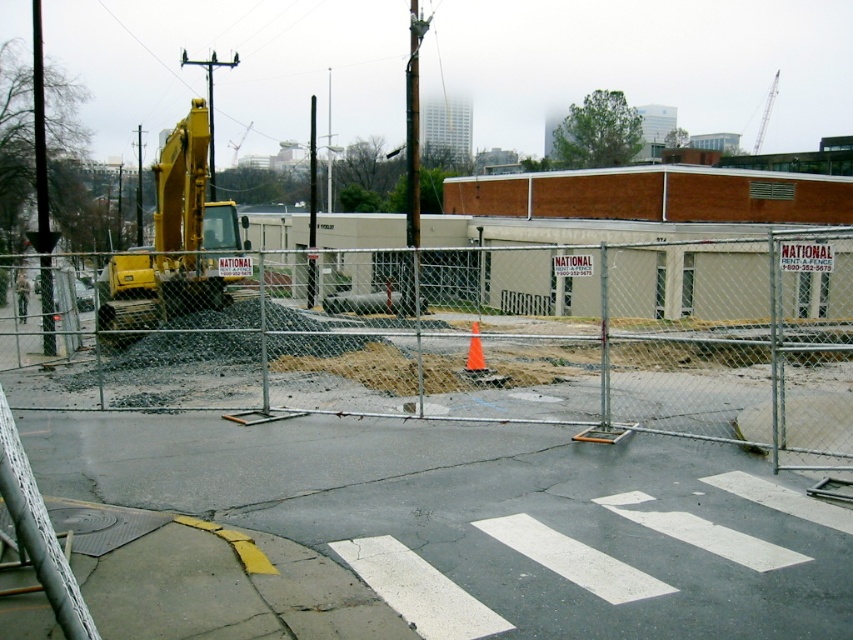
Is silver chain-link fence at center above green camouflage uniform at center?

Correct, silver chain-link fence at center is located above green camouflage uniform at center.

Looking at this image, can you confirm if silver chain-link fence at center is positioned to the right of green camouflage uniform at center?

Correct, you'll find silver chain-link fence at center to the right of green camouflage uniform at center.

Which is behind, point (776, 353) or point (16, 298)?

The point (16, 298) is behind.

Find the location of a particular element. The image size is (853, 640). silver chain-link fence at center is located at coordinates (511, 344).

Is silver chain-link fence at center smaller than orange matte traffic cone at center?

Actually, silver chain-link fence at center might be larger than orange matte traffic cone at center.

Is the position of silver chain-link fence at center more distant than that of orange matte traffic cone at center?

No, it is not.

Where is `silver chain-link fence at center`? silver chain-link fence at center is located at coordinates (511, 344).

What do you see at coordinates (474, 353) in the screenshot?
I see `orange matte traffic cone at center` at bounding box center [474, 353].

Does point (473, 362) come behind point (28, 288)?

No, (473, 362) is closer to viewer.

The image size is (853, 640). I want to click on orange matte traffic cone at center, so click(x=474, y=353).